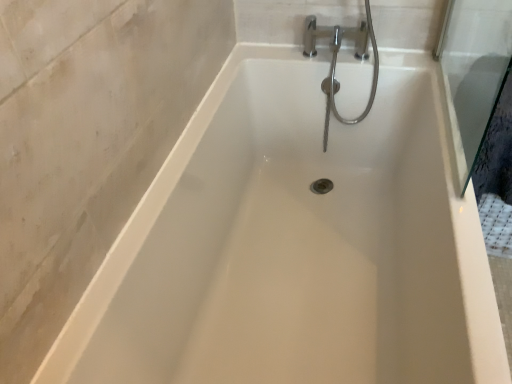
This screenshot has height=384, width=512. What are the coordinates of `transparent glass door at right` in the screenshot? It's located at (473, 72).

This screenshot has width=512, height=384. Describe the element at coordinates (473, 72) in the screenshot. I see `transparent glass door at right` at that location.

The image size is (512, 384). What are the coordinates of `transparent glass door at right` in the screenshot? It's located at (473, 72).